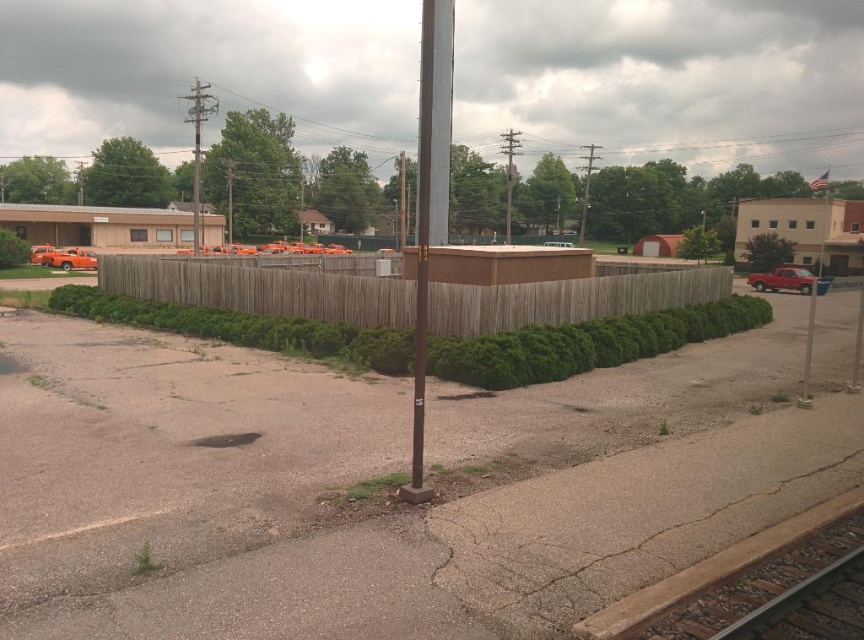
Question: Is green wood fence at center thinner than smooth metal train track at bottom right?

Choices:
 (A) no
 (B) yes

Answer: (A)

Question: Does brown wooden fence at center appear under matte red truck at right?

Choices:
 (A) yes
 (B) no

Answer: (A)

Question: Which point is farther to the camera?

Choices:
 (A) green wood fence at center
 (B) matte red truck at right

Answer: (A)

Question: Among these points, which one is nearest to the camera?

Choices:
 (A) (233, 268)
 (B) (418, 301)
 (C) (767, 284)

Answer: (B)

Question: Which of the following is the farthest from the observer?

Choices:
 (A) smooth metal train track at bottom right
 (B) brown wooden fence at center
 (C) matte red truck at right

Answer: (B)

Question: Is the position of green wood fence at center more distant than that of smooth metal train track at bottom right?

Choices:
 (A) no
 (B) yes

Answer: (B)